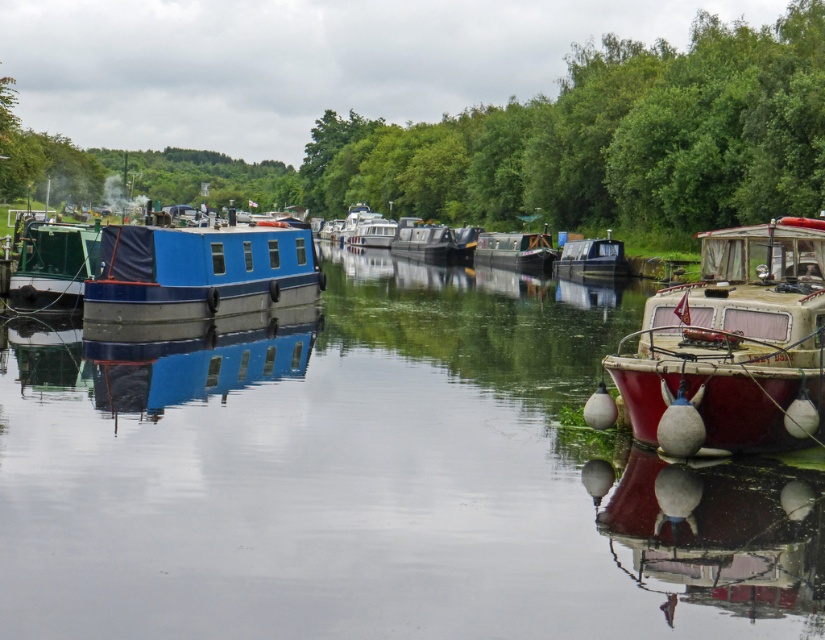
Is blue painted wooden canal boat at center bigger than blue painted wooden barge at center?

Yes, blue painted wooden canal boat at center is bigger than blue painted wooden barge at center.

Can you confirm if blue painted wooden canal boat at center is positioned above blue painted wooden barge at center?

Indeed, blue painted wooden canal boat at center is positioned over blue painted wooden barge at center.

Is point (357, 240) farther from viewer compared to point (470, 241)?

Yes.

At what (x,y) coordinates should I click in order to perform the action: click on blue painted wooden canal boat at center. Please return your answer as a coordinate pair (x, y). The image size is (825, 640). Looking at the image, I should click on (371, 230).

Is rustic wood boat at right thinner than blue painted wooden canal boat at center?

Yes.

Based on the photo, is rustic wood boat at right smaller than blue painted wooden canal boat at center?

Correct, rustic wood boat at right occupies less space than blue painted wooden canal boat at center.

Does point (802, 305) lie in front of point (363, 241)?

Yes, point (802, 305) is in front of point (363, 241).

The width and height of the screenshot is (825, 640). I want to click on rustic wood boat at right, so click(x=736, y=340).

Can you confirm if blue matte houseboat at left is taller than blue painted wooden boat at center?

In fact, blue matte houseboat at left may be shorter than blue painted wooden boat at center.

Is blue matte houseboat at left above blue painted wooden boat at center?

No, blue matte houseboat at left is not above blue painted wooden boat at center.

Is point (158, 227) positioned before point (451, 241)?

Yes, point (158, 227) is in front of point (451, 241).

In order to click on blue matte houseboat at left in this screenshot , I will do `click(200, 272)`.